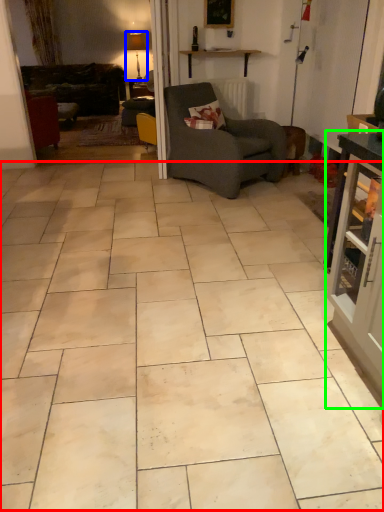
Question: Estimate the real-world distances between objects in this image. Which object is farther from ceramic tile (highlighted by a red box), lamp (highlighted by a blue box) or cabinetry (highlighted by a green box)?

Choices:
 (A) lamp
 (B) cabinetry

Answer: (A)